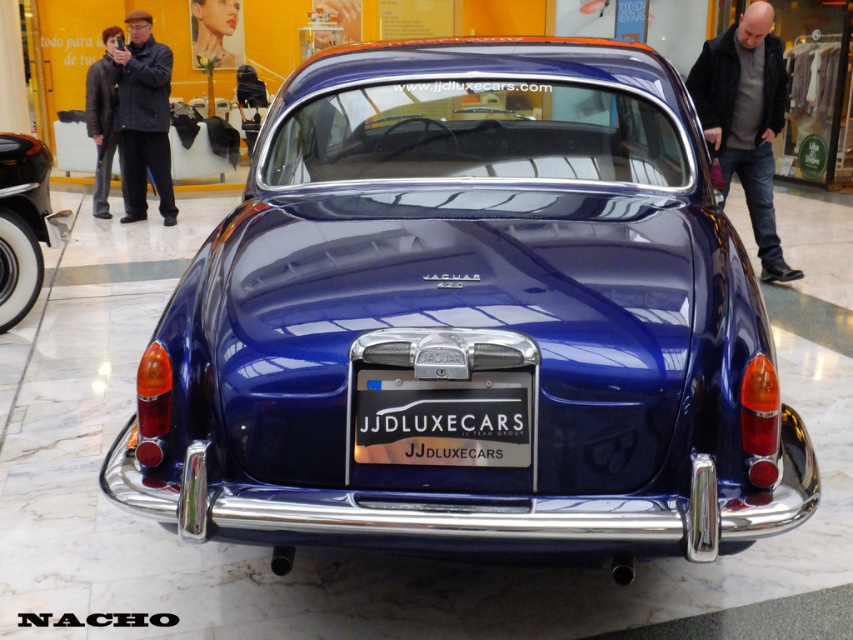
Is glossy blue car at center to the right of black metallic license plate at center from the viewer's perspective?

Indeed, glossy blue car at center is positioned on the right side of black metallic license plate at center.

Which is in front, point (782, 408) or point (517, 461)?

Point (517, 461) is in front.

The width and height of the screenshot is (853, 640). Describe the element at coordinates (473, 317) in the screenshot. I see `glossy blue car at center` at that location.

Where is `glossy blue car at center`? glossy blue car at center is located at coordinates point(473,317).

Is point (454, 413) behind point (12, 324)?

No, (454, 413) is closer to viewer.

Which of these two, black metallic license plate at center or white wall at left, stands shorter?

black metallic license plate at center

Between point (398, 401) and point (6, 221), which one is positioned in front?

Point (398, 401) is more forward.

In order to click on black metallic license plate at center in this screenshot , I will do `click(444, 419)`.

Does shiny blue car at right appear under white wall at left?

No.

Who is positioned more to the right, shiny blue car at right or white wall at left?

From the viewer's perspective, shiny blue car at right appears more on the right side.

What do you see at coordinates (746, 120) in the screenshot? I see `shiny blue car at right` at bounding box center [746, 120].

Where is `shiny blue car at right`? This screenshot has width=853, height=640. shiny blue car at right is located at coordinates (746, 120).